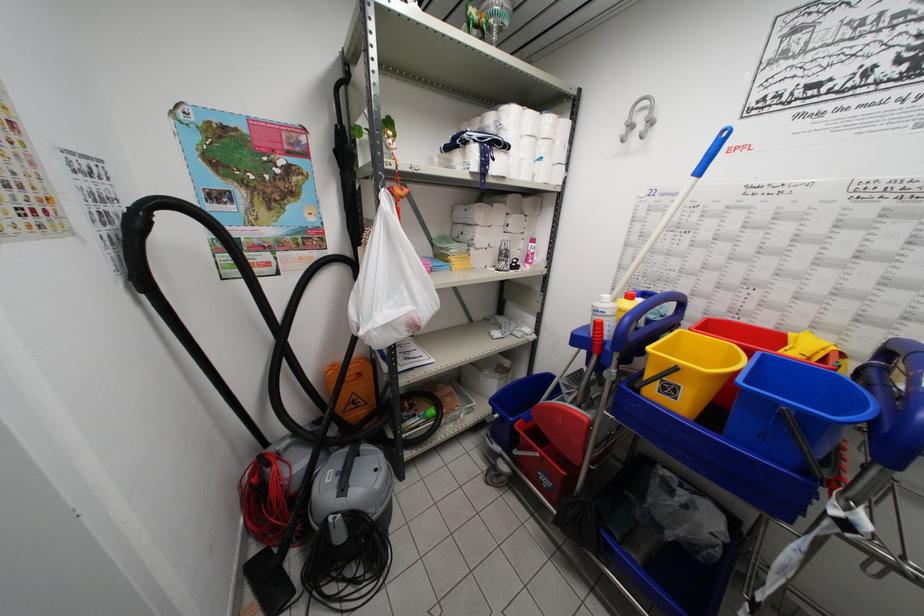
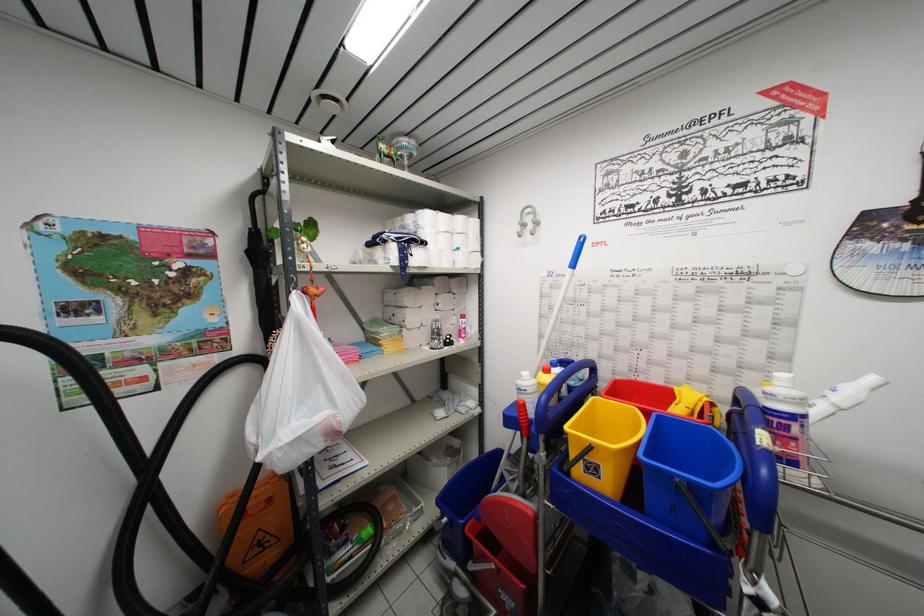
Where in the second image is the point corresponding to point 653,111 from the first image?

(537, 217)